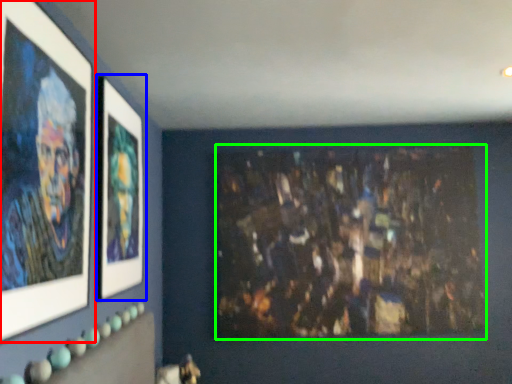
Question: Which object is the closest to the picture frame (highlighted by a red box)? Choose among these: picture frame (highlighted by a blue box) or art (highlighted by a green box).

Choices:
 (A) picture frame
 (B) art

Answer: (A)